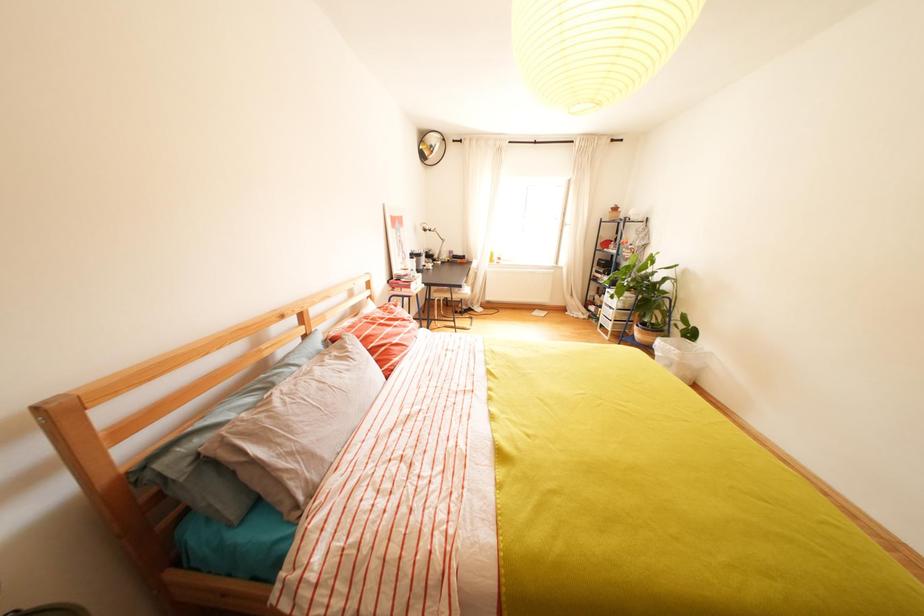
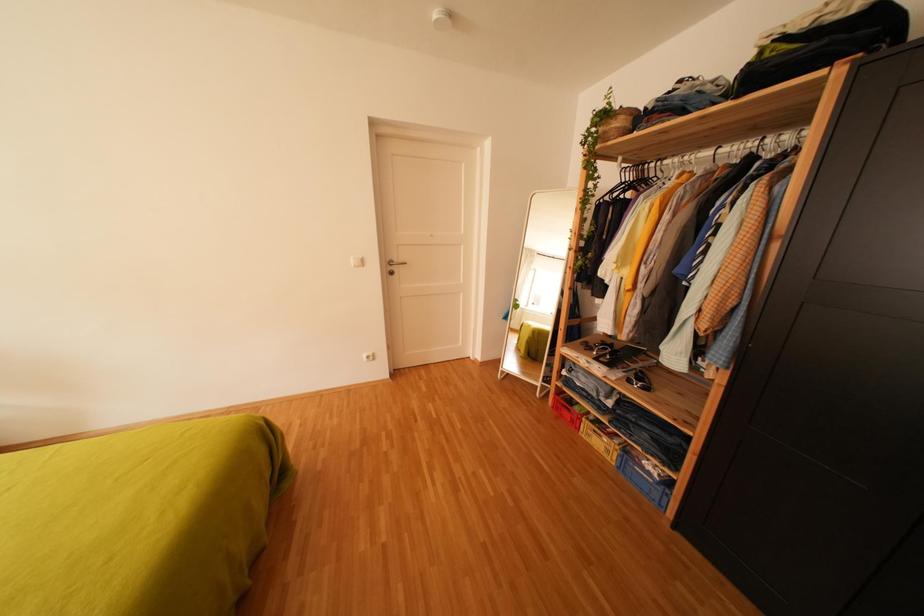
From the picture: How did the camera likely rotate?

The rotation direction of the camera is right-down.